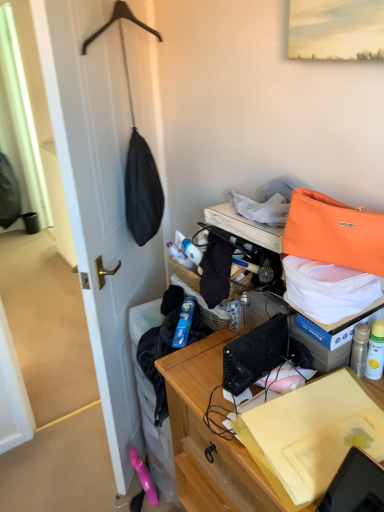
Question: From the image's perspective, is orange leather handbag at upper right below wooden desk at center?

Choices:
 (A) no
 (B) yes

Answer: (A)

Question: Is orange leather handbag at upper right bigger than wooden desk at center?

Choices:
 (A) no
 (B) yes

Answer: (A)

Question: From a real-world perspective, is orange leather handbag at upper right on wooden desk at center?

Choices:
 (A) no
 (B) yes

Answer: (B)

Question: Is orange leather handbag at upper right outside wooden desk at center?

Choices:
 (A) yes
 (B) no

Answer: (A)

Question: Could you tell me if orange leather handbag at upper right is turned towards wooden desk at center?

Choices:
 (A) yes
 (B) no

Answer: (B)

Question: Considering the positions of matte black coat hanger at left and wooden desk at center in the image, is matte black coat hanger at left taller or shorter than wooden desk at center?

Choices:
 (A) tall
 (B) short

Answer: (A)

Question: Relative to wooden desk at center, is matte black coat hanger at left in front or behind?

Choices:
 (A) front
 (B) behind

Answer: (B)

Question: Considering the positions of matte black coat hanger at left and wooden desk at center in the image, is matte black coat hanger at left bigger or smaller than wooden desk at center?

Choices:
 (A) big
 (B) small

Answer: (B)

Question: Is matte black coat hanger at left wider or thinner than wooden desk at center?

Choices:
 (A) wide
 (B) thin

Answer: (B)

Question: Which is correct: matte black coat hanger at left is inside orange leather handbag at upper right, or outside of it?

Choices:
 (A) outside
 (B) inside

Answer: (A)

Question: From their relative heights in the image, would you say matte black coat hanger at left is taller or shorter than orange leather handbag at upper right?

Choices:
 (A) short
 (B) tall

Answer: (B)

Question: Considering the relative positions of matte black coat hanger at left and orange leather handbag at upper right in the image provided, is matte black coat hanger at left to the left or to the right of orange leather handbag at upper right?

Choices:
 (A) right
 (B) left

Answer: (B)

Question: Looking at the image, does matte black coat hanger at left seem bigger or smaller compared to orange leather handbag at upper right?

Choices:
 (A) big
 (B) small

Answer: (A)

Question: Relative to matte black coat hanger at left, is wooden desk at center in front or behind?

Choices:
 (A) behind
 (B) front

Answer: (B)

Question: Is wooden desk at center inside or outside of matte black coat hanger at left?

Choices:
 (A) outside
 (B) inside

Answer: (A)